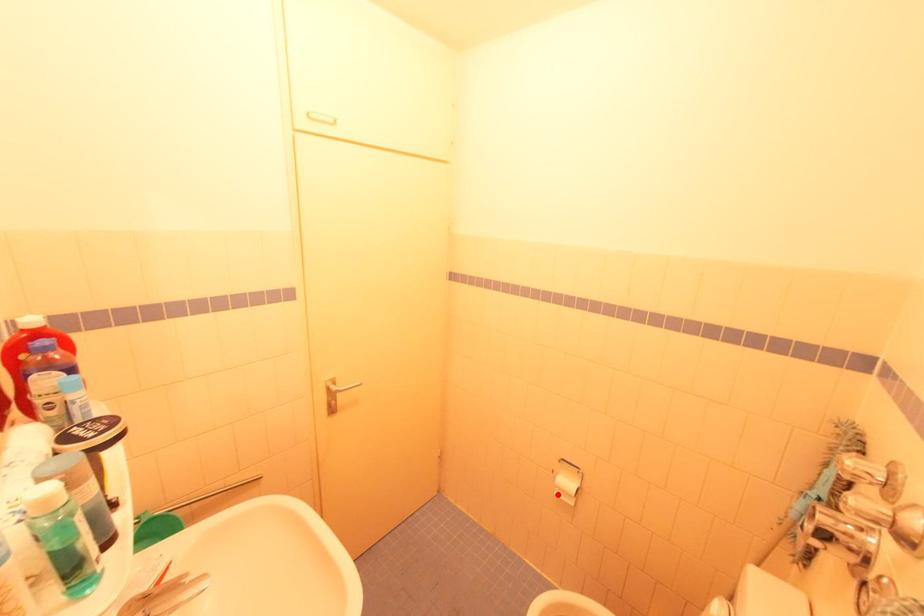
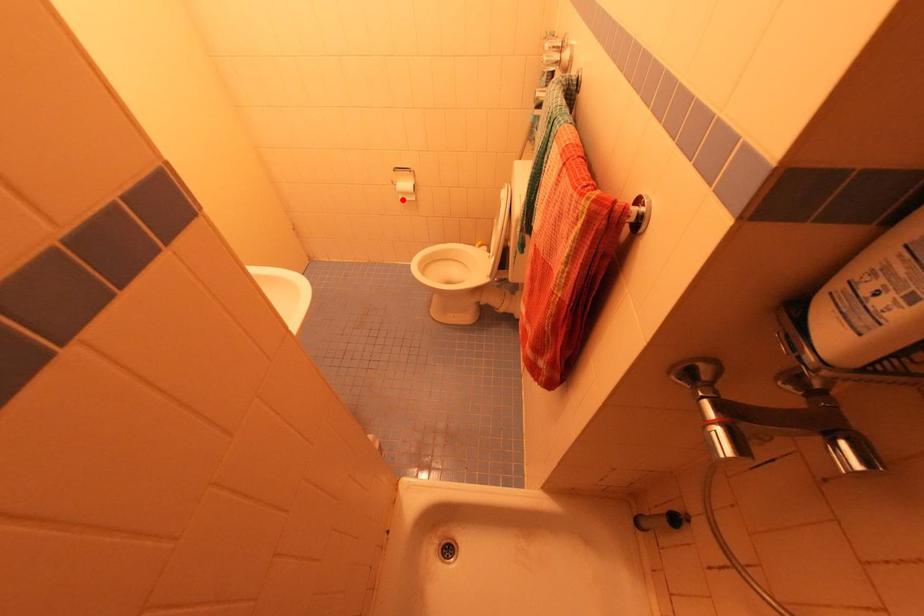
I am providing you with two images of the same scene from different viewpoints. A red point is marked on the first image and another point is marked on the second image. Are the points marked in image1 and image2 representing the same 3D position?

Yes